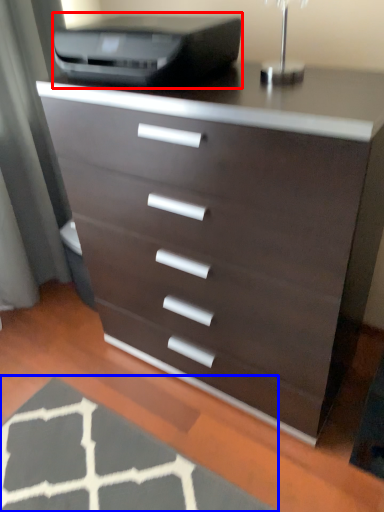
Question: Which object is closer to the camera taking this photo, printer (highlighted by a red box) or doormat (highlighted by a blue box)?

Choices:
 (A) printer
 (B) doormat

Answer: (B)